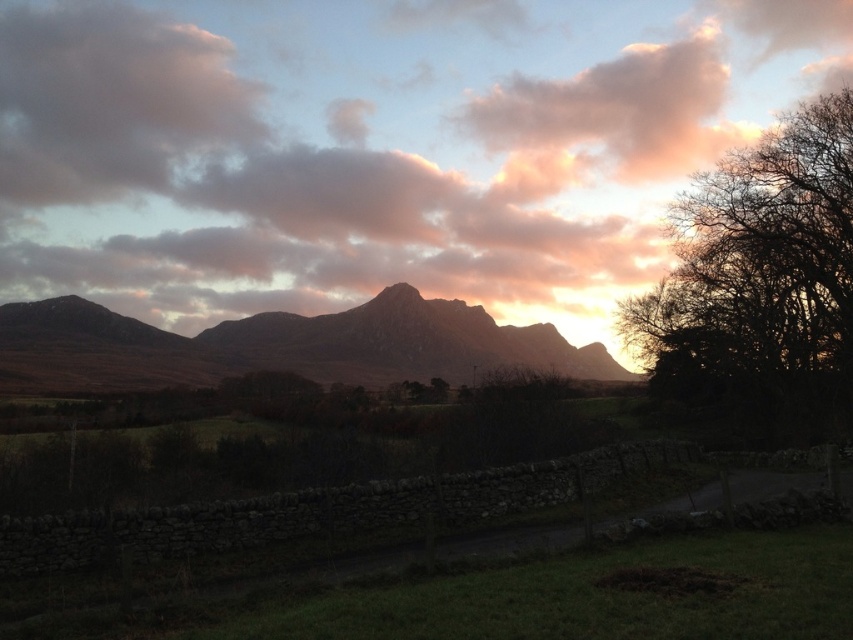
Question: Can you confirm if pink fluffy cloud at upper center is positioned to the left of rugged brown mountain at center?

Choices:
 (A) no
 (B) yes

Answer: (A)

Question: Based on their relative distances, which object is nearer to the pink fluffy cloud at upper center?

Choices:
 (A) silhouette bare tree at right
 (B) rugged brown mountain at center

Answer: (B)

Question: Considering the real-world distances, which object is closest to the rugged brown mountain at center?

Choices:
 (A) silhouette bare tree at right
 (B) pink fluffy cloud at upper center

Answer: (A)

Question: Which object is farther from the camera taking this photo?

Choices:
 (A) rugged brown mountain at center
 (B) pink fluffy cloud at upper center
 (C) silhouette bare tree at right

Answer: (B)

Question: Is pink fluffy cloud at upper center positioned at the back of rugged brown mountain at center?

Choices:
 (A) no
 (B) yes

Answer: (B)

Question: Is pink fluffy cloud at upper center below rugged brown mountain at center?

Choices:
 (A) no
 (B) yes

Answer: (A)